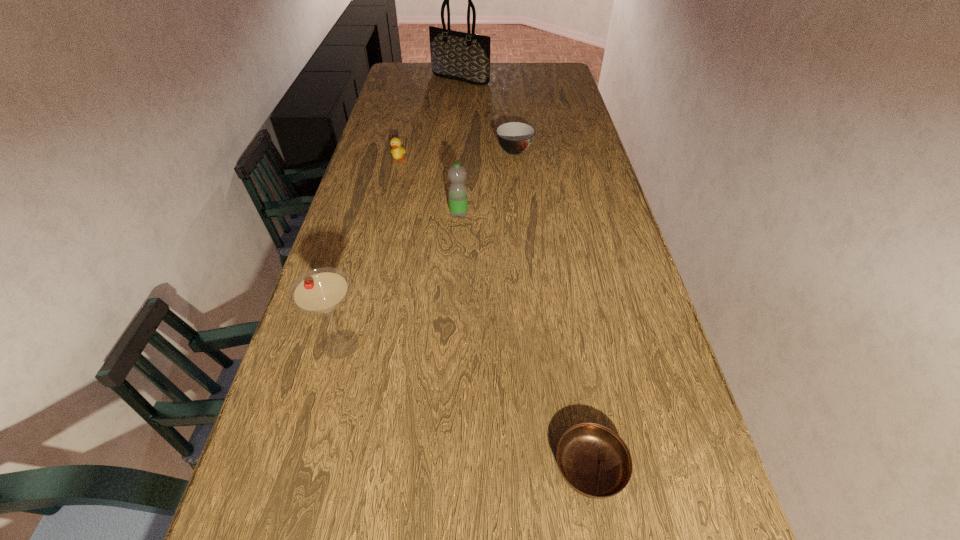
In order to click on free space at the left edge of the desktop in this screenshot , I will do `click(393, 221)`.

The width and height of the screenshot is (960, 540). What are the coordinates of `blank space at the right edge of the desktop` in the screenshot? It's located at (579, 251).

This screenshot has width=960, height=540. Find the location of `free space at the far right corner of the desktop`. free space at the far right corner of the desktop is located at coordinates (554, 66).

Identify the location of vacant point located between the water bottle and the taller soup bowl. (487, 183).

The image size is (960, 540). What are the coordinates of `free point between the martini and the farthest object` in the screenshot? It's located at (400, 212).

Where is `vacant space that is in between the farther soup bowl and the tote bag`? The height and width of the screenshot is (540, 960). vacant space that is in between the farther soup bowl and the tote bag is located at coordinates (488, 114).

The image size is (960, 540). Find the location of `free spot between the duckling and the farther soup bowl`. free spot between the duckling and the farther soup bowl is located at coordinates (457, 156).

Where is `free space between the fifth farthest object and the duckling`? Image resolution: width=960 pixels, height=540 pixels. free space between the fifth farthest object and the duckling is located at coordinates (370, 253).

Locate an element on the screen. This screenshot has width=960, height=540. vacant space that's between the nearest object and the tallest object is located at coordinates (525, 273).

You are a GUI agent. You are given a task and a screenshot of the screen. Output one action in this format:
    pyautogui.click(x=<x>, y=<y>)
    Task: Click on the free space between the tote bag and the water bottle
    
    Given the screenshot: What is the action you would take?
    pyautogui.click(x=460, y=146)